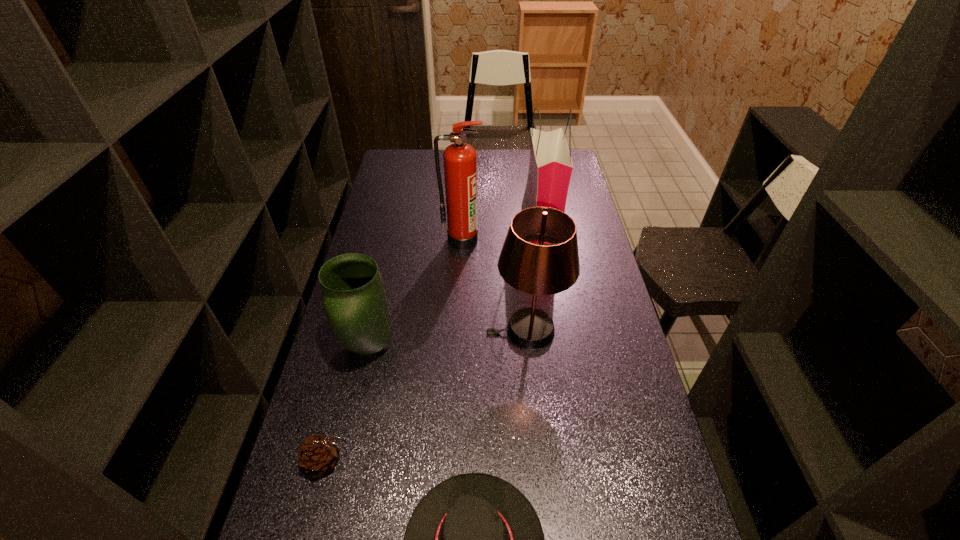
Where is `vacant space located on the front-facing side of the lampshade`? vacant space located on the front-facing side of the lampshade is located at coordinates (443, 330).

Where is `free space located 0.250m on the front-facing side of the lampshade`? This screenshot has height=540, width=960. free space located 0.250m on the front-facing side of the lampshade is located at coordinates (407, 330).

The height and width of the screenshot is (540, 960). What are the coordinates of `vacant region located on the back of the fourth tallest object` in the screenshot? It's located at (381, 292).

Identify the location of vacant point located with a leaf charm attached to the pinecone. (431, 462).

Find the location of a particular element. This screenshot has width=960, height=540. vase that is at the left edge is located at coordinates (354, 298).

Locate an element on the screen. The height and width of the screenshot is (540, 960). pinecone present at the left edge is located at coordinates (318, 455).

Locate an element on the screen. object that is at the right edge is located at coordinates (550, 167).

You are a GUI agent. You are given a task and a screenshot of the screen. Output one action in this format:
    pyautogui.click(x=<x>, y=<y>)
    Task: Click on the vacant space at the far edge
    The width and height of the screenshot is (960, 540).
    Given the screenshot: What is the action you would take?
    pyautogui.click(x=528, y=153)

Where is `vacant space at the left edge`? The image size is (960, 540). vacant space at the left edge is located at coordinates (361, 379).

The width and height of the screenshot is (960, 540). In the image, there is a desktop. Find the location of `blank space at the right edge`. blank space at the right edge is located at coordinates (605, 267).